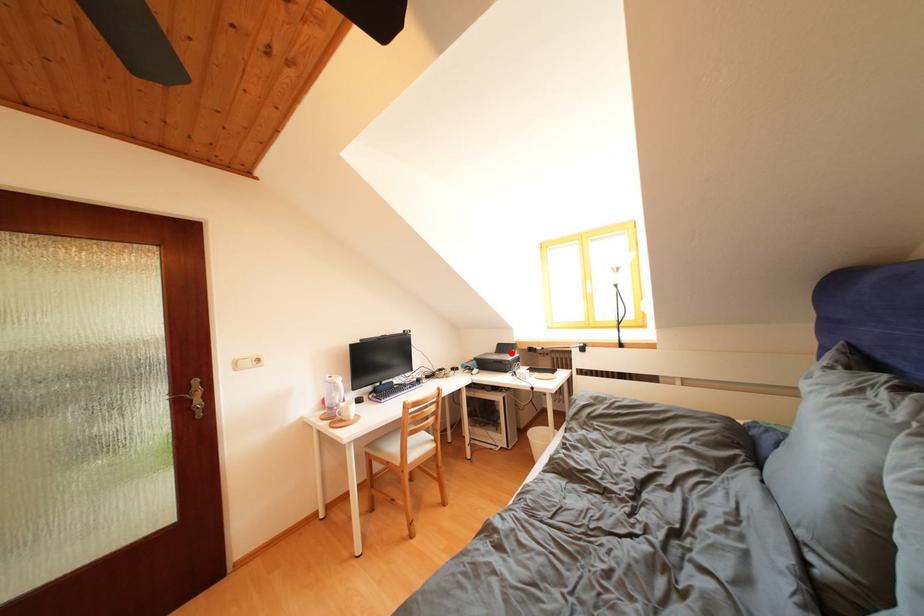
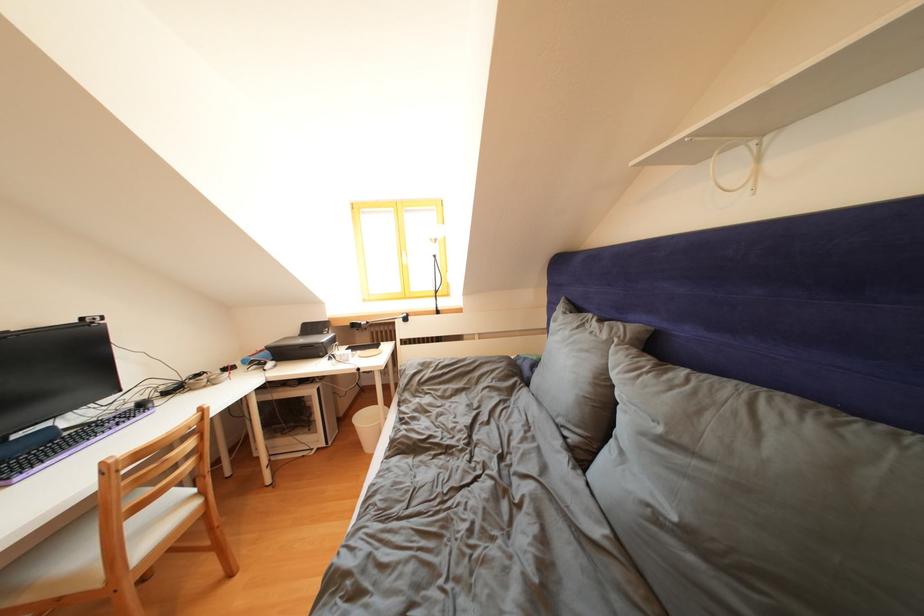
Where in the second image is the point corresponding to the highlighted location from the first image?

(319, 333)